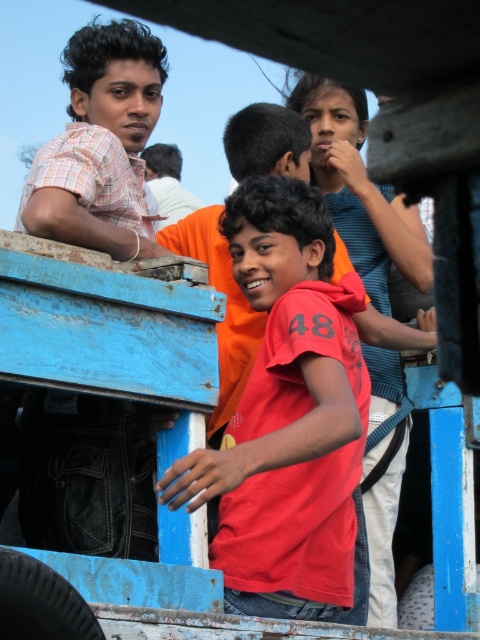
Can you confirm if matte red t-shirt at center is thinner than matte plaid shirt at left?

In fact, matte red t-shirt at center might be wider than matte plaid shirt at left.

Does matte red t-shirt at center have a larger size compared to matte plaid shirt at left?

Incorrect, matte red t-shirt at center is not larger than matte plaid shirt at left.

At what (x,y) coordinates should I click in order to perform the action: click on matte red t-shirt at center. Please return your answer as a coordinate pair (x, y). This screenshot has width=480, height=640. Looking at the image, I should click on (287, 416).

Who is more distant from viewer, (271, 573) or (159, 170)?

The point (159, 170) is more distant.

Can you confirm if matte red t-shirt at center is positioned above white shirt at center?

Actually, matte red t-shirt at center is below white shirt at center.

Where is `matte red t-shirt at center`? This screenshot has width=480, height=640. matte red t-shirt at center is located at coordinates coord(287,416).

Does point (132, 88) lie behind point (147, 166)?

No, (132, 88) is in front of (147, 166).

Which of these two, matte plaid shirt at left or white shirt at center, stands shorter?

With less height is white shirt at center.

Is point (55, 154) less distant than point (170, 198)?

Yes, it is.

The image size is (480, 640). Identify the location of matte plaid shirt at left. (100, 145).